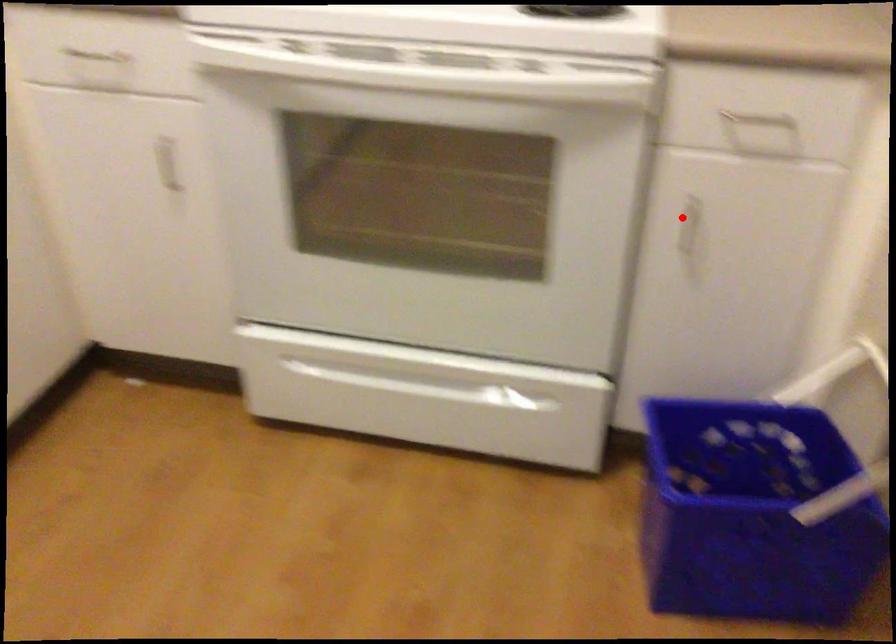
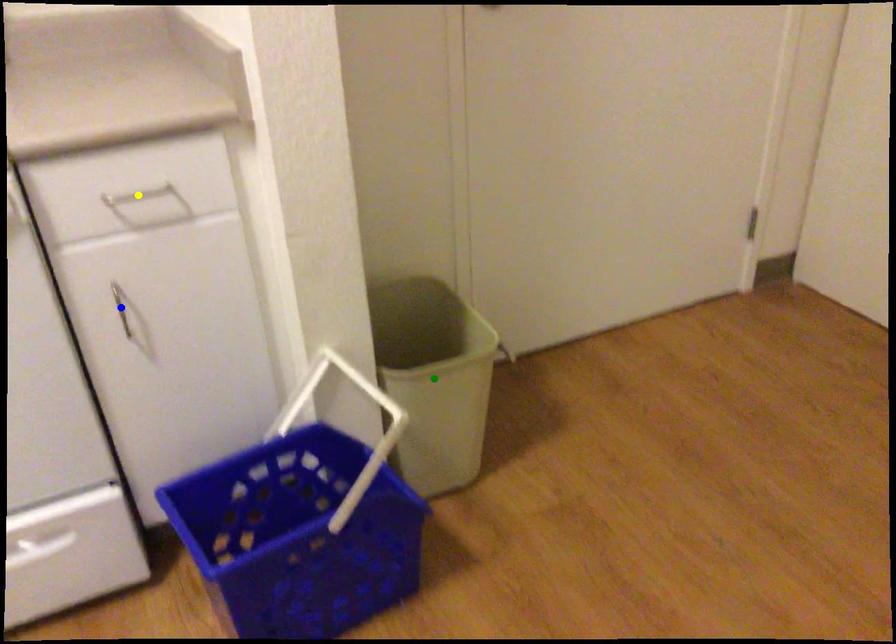
Question: I am providing you with two images of the same scene from different viewpoints. A red point is marked on the first image. You are given multiple points on the second image. Which mark in image 2 goes with the point in image 1?

Choices:
 (A) green point
 (B) blue point
 (C) yellow point

Answer: (B)